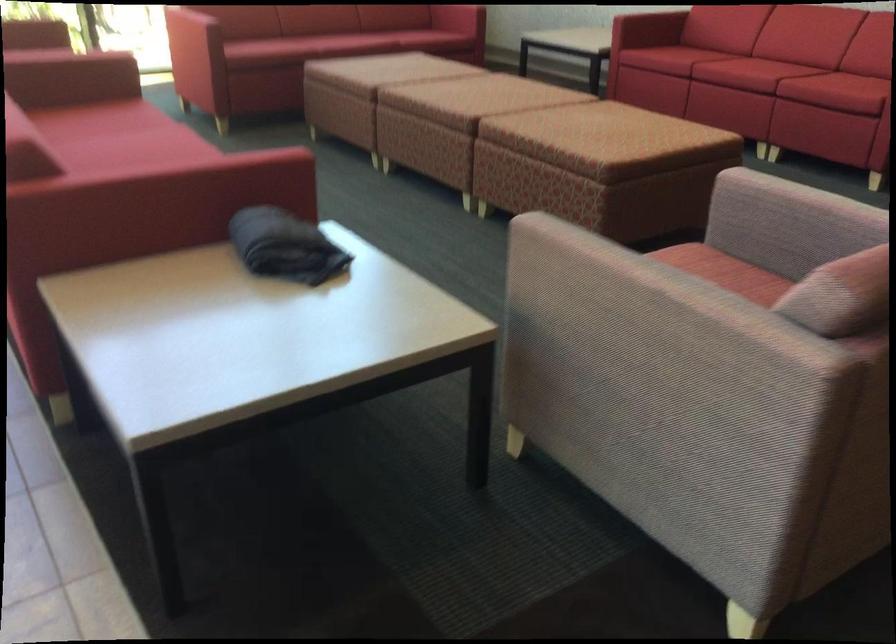
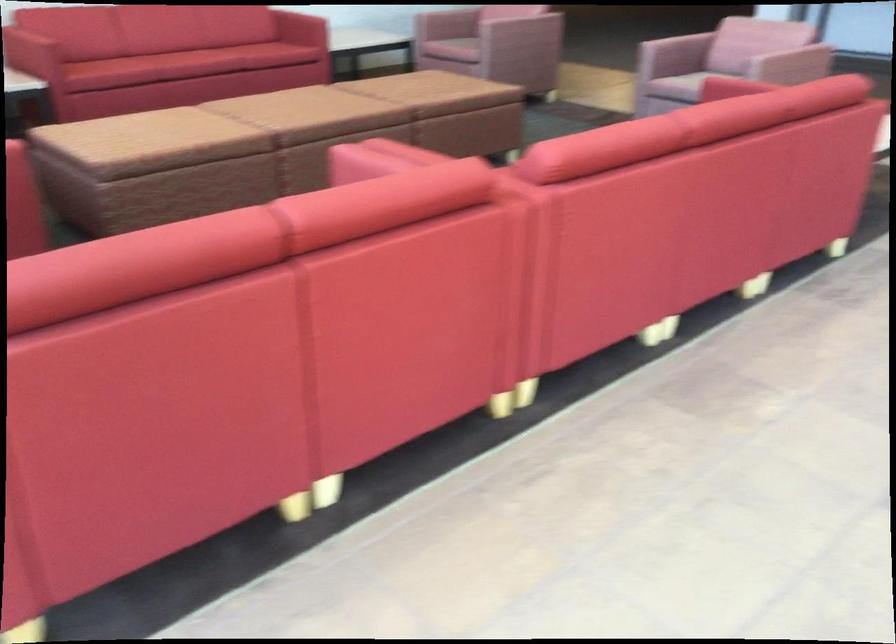
The images are taken continuously from a first-person perspective. In which direction is your viewpoint rotating?

The camera's rotation is toward right-down.